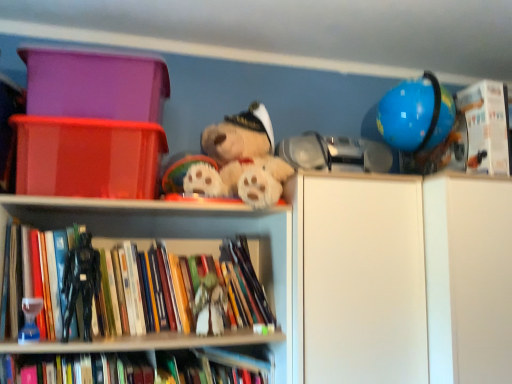
In order to face red plastic storage box at left, which is the 1th storage box in bottom-to-top order, should I rotate leftwards or rightwards?

Rotate your view left by about 20.284°.

I want to click on matte plastic storage box at upper left, which ranks as the first storage box in top-to-bottom order, so click(x=95, y=84).

The height and width of the screenshot is (384, 512). Describe the element at coordinates (30, 320) in the screenshot. I see `translucent glass hourglass at lower left, acting as the 1th toy starting from the front` at that location.

In order to face black matte figurine at left, should I rotate leftwards or rightwards?

Rotate left and turn 21.923 degrees.

The image size is (512, 384). Describe the element at coordinates (81, 283) in the screenshot. I see `black matte figurine at left` at that location.

The width and height of the screenshot is (512, 384). What do you see at coordinates (486, 126) in the screenshot?
I see `white cardboard box at upper right, acting as the first book starting from the top` at bounding box center [486, 126].

How much space does white cardboard box at upper right, which is the third book from bottom to top, occupy vertically?

It is 12.08 inches.

The width and height of the screenshot is (512, 384). I want to click on red plastic storage box at left, the 2th storage box from the top, so click(88, 157).

Choose the correct answer: Is black matte figurine at left inside white matte cabinet at right or outside it?

black matte figurine at left is outside white matte cabinet at right.

Is black matte figurine at left wider or thinner than white matte cabinet at right?

In the image, black matte figurine at left appears to be more narrow than white matte cabinet at right.

Which point is more forward, (90, 289) or (445, 197)?

Point (90, 289)

How far apart are matte plastic storage box at upper left, which is the second storage box from bottom to top, and hardcover book at center, the 1th book in the bottom-to-top sequence?

29.32 inches.

From a real-world perspective, is matte plastic storage box at upper left, which ranks as the first storage box in top-to-bottom order, on hardcover book at center, the 1th book in the bottom-to-top sequence?

Yes, from a real-world perspective, matte plastic storage box at upper left, which ranks as the first storage box in top-to-bottom order, is over hardcover book at center, the 1th book in the bottom-to-top sequence

From the image's perspective, which one is positioned higher, matte plastic storage box at upper left, which ranks as the first storage box in top-to-bottom order, or hardcover book at center, positioned as the second book in right-to-left order?

matte plastic storage box at upper left, which ranks as the first storage box in top-to-bottom order, is shown above in the image.

Based on the photo, is the surface of matte plastic storage box at upper left, which is the second storage box from bottom to top, in direct contact with hardcover book at center, the 1th book in the bottom-to-top sequence?

No, matte plastic storage box at upper left, which is the second storage box from bottom to top, is not beside hardcover book at center, the 1th book in the bottom-to-top sequence.

How many degrees apart are the facing directions of white cardboard box at upper right, which is the third book from bottom to top, and matte plastic storage box at upper left, which is the second storage box from bottom to top?

The facing directions of white cardboard box at upper right, which is the third book from bottom to top, and matte plastic storage box at upper left, which is the second storage box from bottom to top, are 9.66 degrees apart.

Does white cardboard box at upper right, which ranks as the third book in left-to-right order, come in front of matte plastic storage box at upper left, which is the second storage box from bottom to top?

No, white cardboard box at upper right, which ranks as the third book in left-to-right order, is further to the viewer.

Is matte plastic storage box at upper left, which is the second storage box from bottom to top, inside white cardboard box at upper right, arranged as the first book when viewed from the right?

Definitely not — matte plastic storage box at upper left, which is the second storage box from bottom to top, is not inside white cardboard box at upper right, arranged as the first book when viewed from the right.

From the image's perspective, is white cardboard box at upper right, which is the third book from bottom to top, below matte plastic storage box at upper left, which ranks as the first storage box in top-to-bottom order?

Correct, white cardboard box at upper right, which is the third book from bottom to top, appears lower than matte plastic storage box at upper left, which ranks as the first storage box in top-to-bottom order, in the image.

Can you confirm if white matte cabinet at right is taller than black matte figurine at left?

Correct, white matte cabinet at right is much taller as black matte figurine at left.

Between white matte cabinet at right and black matte figurine at left, which one has smaller size?

black matte figurine at left is smaller.

Which object is closer to the camera taking this photo, hardcover books at left, the second book positioned from the bottom, or translucent glass hourglass at lower left, which is the first toy in left-to-right order?

translucent glass hourglass at lower left, which is the first toy in left-to-right order, is closer to the camera.

From a real-world perspective, starting from the translucent glass hourglass at lower left, placed as the second toy when sorted from right to left, which book is the 1st one vertically above it? Please provide its 2D coordinates.

[(164, 292)]

Consider the image. From a real-world perspective, is hardcover books at left, marked as the 2th book in a top-to-bottom arrangement, below translucent glass hourglass at lower left, the second toy when ordered from back to front?

No, from a real-world perspective, hardcover books at left, marked as the 2th book in a top-to-bottom arrangement, is not beneath translucent glass hourglass at lower left, the second toy when ordered from back to front.

Considering the sizes of objects white matte cabinet at right and matte plastic storage box at upper left, which ranks as the first storage box in top-to-bottom order, in the image provided, who is shorter, white matte cabinet at right or matte plastic storage box at upper left, which ranks as the first storage box in top-to-bottom order,?

Standing shorter between the two is matte plastic storage box at upper left, which ranks as the first storage box in top-to-bottom order.

Looking at this image, which object is closer to the camera, white matte cabinet at right or matte plastic storage box at upper left, which is the second storage box from bottom to top?

Positioned in front is white matte cabinet at right.

Is white matte cabinet at right not near matte plastic storage box at upper left, which ranks as the first storage box in top-to-bottom order?

No.

I want to click on cabinetry below the matte plastic storage box at upper left, which is the second storage box from bottom to top (from a real-world perspective), so click(x=404, y=280).

Is white cardboard box at upper right, arranged as the first book when viewed from the right, in contact with black matte figurine at left?

There is a gap between white cardboard box at upper right, arranged as the first book when viewed from the right, and black matte figurine at left.

From their relative heights in the image, would you say white cardboard box at upper right, arranged as the first book when viewed from the right, is taller or shorter than black matte figurine at left?

In the image, white cardboard box at upper right, arranged as the first book when viewed from the right, appears to be taller than black matte figurine at left.

Which point is more forward, (503, 131) or (85, 232)?

Positioned in front is point (85, 232).

The image size is (512, 384). There is a black matte figurine at left. Find the location of `the 2nd book above it (from a real-world perspective)`. the 2nd book above it (from a real-world perspective) is located at coordinates (486, 126).

The width and height of the screenshot is (512, 384). Identify the location of figurine that is on the left side of white matte cabinet at right. (81, 283).

Locate an element on the screen. The image size is (512, 384). the 2nd storage box behind the hardcover book at center, the 2th book in the left-to-right sequence, counting from the anchor's position is located at coordinates (95, 84).

When comparing their distances from hardcover book at center, the 2th book in the left-to-right sequence, does hardcover books at left, which ranks as the third book in right-to-left order, or red plastic storage box at left, which is the 1th storage box in bottom-to-top order, seem closer?

Among the two, hardcover books at left, which ranks as the third book in right-to-left order, is located nearer to hardcover book at center, the 2th book in the left-to-right sequence.

Looking at the image, which one is located closer to hardcover books at left, which appears as the 1th book when viewed from the left, translucent glass hourglass at lower left, placed as the second toy when sorted from right to left, or white matte cabinet at right?

translucent glass hourglass at lower left, placed as the second toy when sorted from right to left, is positioned closer to the anchor hardcover books at left, which appears as the 1th book when viewed from the left.

Which object lies nearer to the anchor point translucent glass hourglass at lower left, the second toy when ordered from back to front, white matte cabinet at right or white matte figurine at center, acting as the first toy starting from the right?

white matte figurine at center, acting as the first toy starting from the right, lies closer to translucent glass hourglass at lower left, the second toy when ordered from back to front, than the other object.

Considering their positions, is matte plastic storage box at upper left, which is the second storage box from bottom to top, positioned further to hardcover books at left, marked as the 2th book in a top-to-bottom arrangement, than hardcover book at center, positioned as the second book in right-to-left order?

matte plastic storage box at upper left, which is the second storage box from bottom to top, is positioned further to the anchor hardcover books at left, marked as the 2th book in a top-to-bottom arrangement.

From the image, which object appears to be farther from white cardboard box at upper right, acting as the first book starting from the top, black matte figurine at left or matte plastic storage box at upper left, which is the second storage box from bottom to top?

Among the two, black matte figurine at left is located further to white cardboard box at upper right, acting as the first book starting from the top.

Considering their positions, is white matte figurine at center, acting as the first toy starting from the right, positioned closer to matte plastic storage box at upper left, which ranks as the first storage box in top-to-bottom order, than red plastic storage box at left, which is the 1th storage box in bottom-to-top order?

red plastic storage box at left, which is the 1th storage box in bottom-to-top order, is positioned closer to the anchor matte plastic storage box at upper left, which ranks as the first storage box in top-to-bottom order.

Based on their spatial positions, is black matte figurine at left or white matte cabinet at right further from red plastic storage box at left, which is the 1th storage box in bottom-to-top order?

white matte cabinet at right is further to red plastic storage box at left, which is the 1th storage box in bottom-to-top order.

Consider the image. From the image, which object appears to be nearer to matte plastic storage box at upper left, which is the second storage box from bottom to top, white cardboard box at upper right, arranged as the first book when viewed from the right, or hardcover book at center, positioned as the 3th book in top-to-bottom order?

Based on the image, hardcover book at center, positioned as the 3th book in top-to-bottom order, appears to be nearer to matte plastic storage box at upper left, which is the second storage box from bottom to top.

This screenshot has width=512, height=384. I want to click on storage box that lies between matte plastic storage box at upper left, which ranks as the first storage box in top-to-bottom order, and hardcover book at center, the 2th book in the left-to-right sequence, from top to bottom, so click(x=88, y=157).

The image size is (512, 384). What are the coordinates of `figurine between matte plastic storage box at upper left, which ranks as the first storage box in top-to-bottom order, and white matte figurine at center, positioned as the first toy in back-to-front order, in the up-down direction` in the screenshot? It's located at (81, 283).

You are a GUI agent. You are given a task and a screenshot of the screen. Output one action in this format:
    pyautogui.click(x=<x>, y=<y>)
    Task: Click on the book situated between hardcover books at left, which appears as the 1th book when viewed from the left, and white cardboard box at upper right, acting as the first book starting from the top, from left to right
    The image size is (512, 384).
    Given the screenshot: What is the action you would take?
    pyautogui.click(x=136, y=368)

This screenshot has height=384, width=512. In order to click on book between red plastic storage box at left, the 2th storage box from the top, and white matte figurine at center, positioned as the first toy in back-to-front order, vertically in this screenshot , I will do `click(164, 292)`.